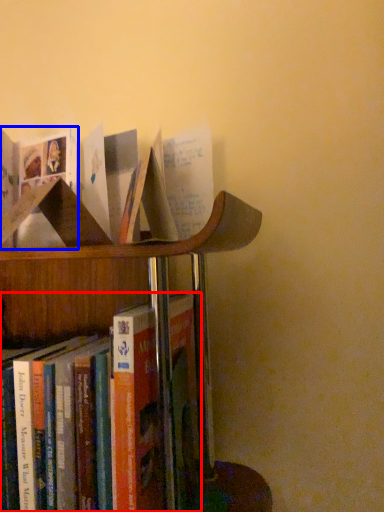
Question: Which of the following is the closest to the observer, book (highlighted by a red box) or book (highlighted by a blue box)?

Choices:
 (A) book
 (B) book

Answer: (B)